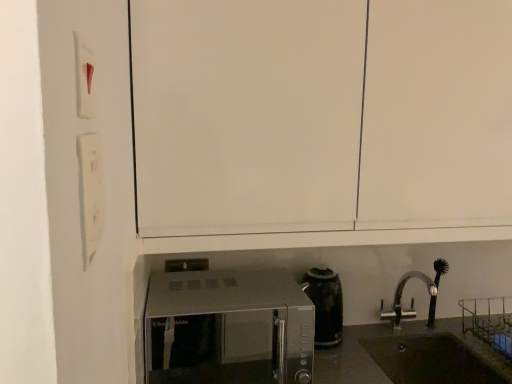
Question: From the image's perspective, relative to white matte cabinet at upper center, is satin silver microwave at lower center above or below?

Choices:
 (A) above
 (B) below

Answer: (B)

Question: Is satin silver microwave at lower center taller or shorter than white matte cabinet at upper center?

Choices:
 (A) short
 (B) tall

Answer: (A)

Question: Estimate the real-world distances between objects in this image. Which object is closer to the white matte light switch at left, which is counted as the first light switch, starting from the bottom?

Choices:
 (A) white matte cabinet at upper center
 (B) white plastic light switch at upper left, placed as the second light switch when sorted from bottom to top
 (C) black glossy coffee pot at center
 (D) satin silver microwave at lower center
 (E) black matte sink at lower right

Answer: (B)

Question: Considering the real-world distances, which object is farthest from the white matte cabinet at upper center?

Choices:
 (A) white matte light switch at left, which is counted as the first light switch, starting from the bottom
 (B) black matte sink at lower right
 (C) satin silver microwave at lower center
 (D) black glossy coffee pot at center
 (E) white plastic light switch at upper left, the 1th light switch from the top

Answer: (C)